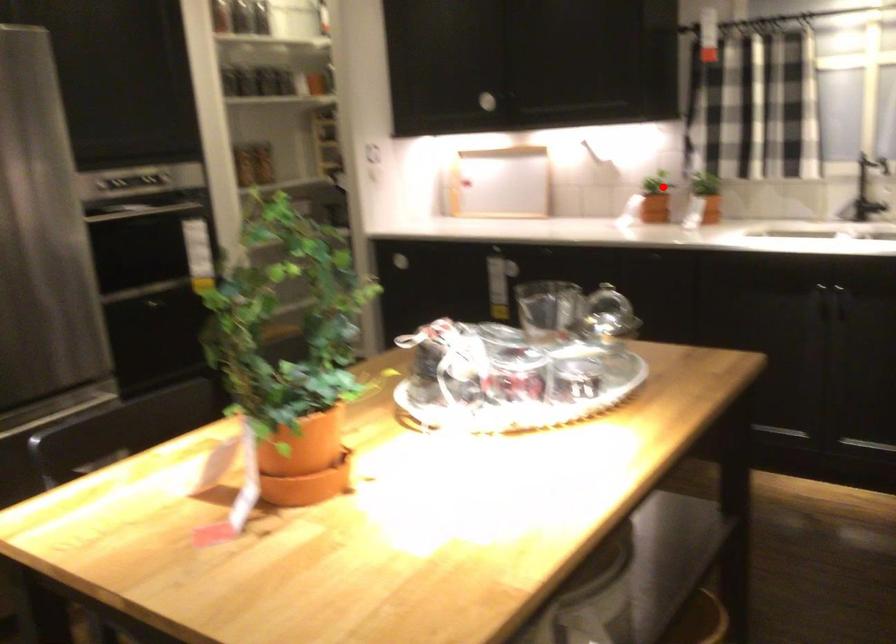
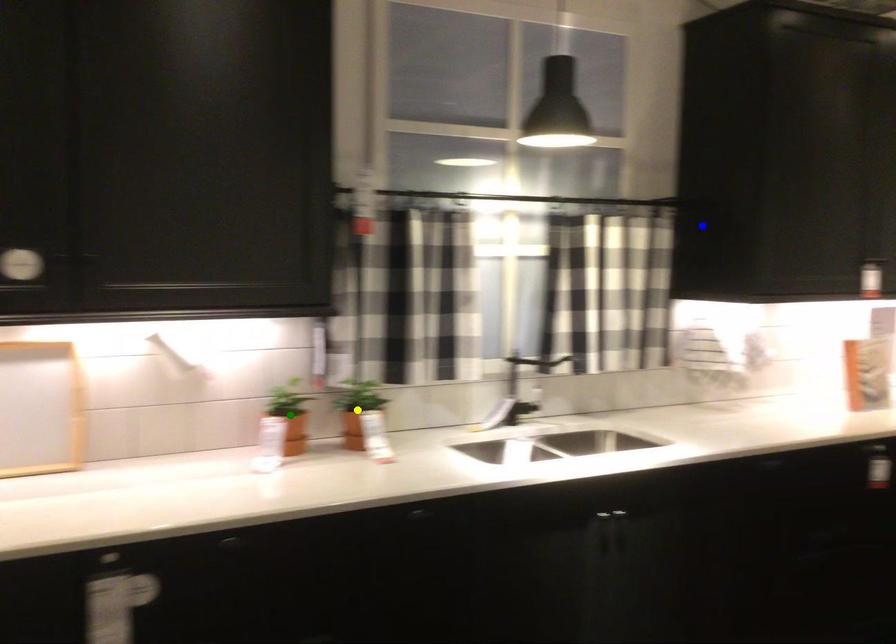
Question: I am providing you with two images of the same scene from different viewpoints. A red point is marked on the first image. You are given multiple points on the second image. Which mark in image 2 goes with the point in image 1?

Choices:
 (A) blue point
 (B) green point
 (C) yellow point

Answer: (B)